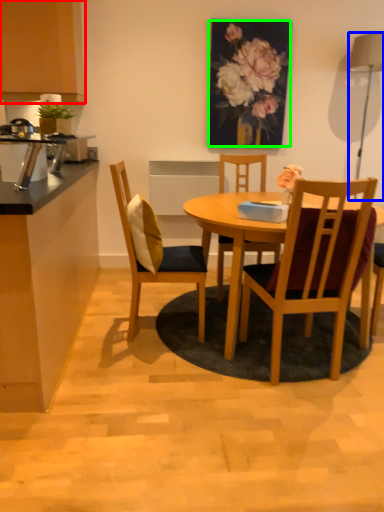
Question: Estimate the real-world distances between objects in this image. Which object is farther from cabinetry (highlighted by a red box), lamp (highlighted by a blue box) or floral arrangement (highlighted by a green box)?

Choices:
 (A) lamp
 (B) floral arrangement

Answer: (A)